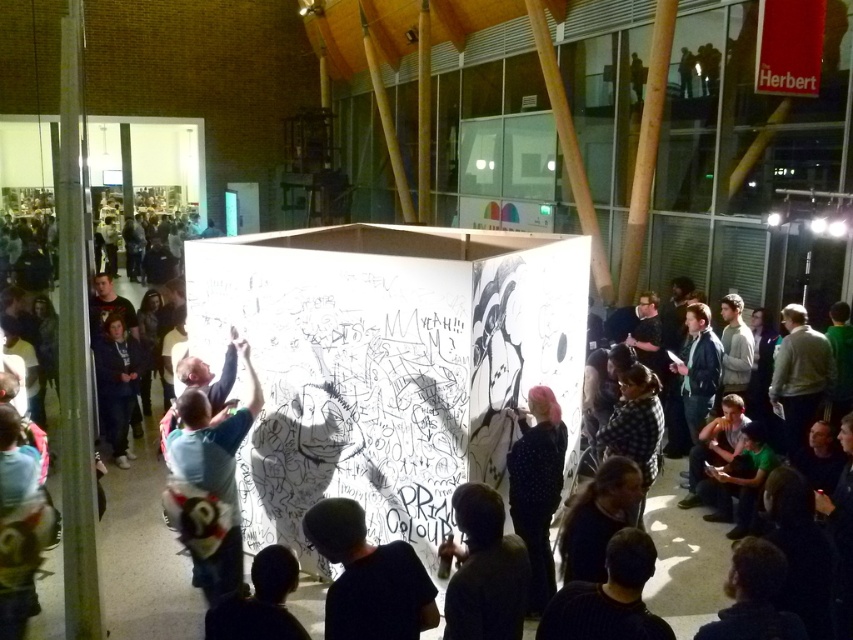
Is point (527, 481) farther from viewer compared to point (115, 397)?

No, it is not.

Is point (538, 492) closer to viewer compared to point (119, 444)?

Yes.

Is point (544, 515) more distant than point (125, 340)?

No, (544, 515) is in front of (125, 340).

Identify the location of pink hair at center. (537, 486).

Between dark gray hoodie at center and pink hair at center, which one has more height?

pink hair at center

Which is above, dark gray hoodie at center or pink hair at center?

dark gray hoodie at center

Which is in front, point (351, 589) or point (544, 467)?

Point (351, 589)

Locate an element on the screen. This screenshot has height=640, width=853. dark gray hoodie at center is located at coordinates (368, 577).

Measure the distance between dark gray hoodie at center and camera.

They are 7.81 feet apart.

Who is positioned more to the left, dark gray hoodie at center or dark blue hoodie at center?

dark blue hoodie at center

I want to click on dark gray hoodie at center, so click(x=368, y=577).

Identify the location of dark gray hoodie at center. (368, 577).